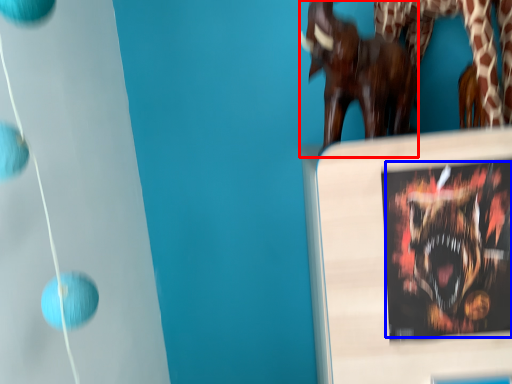
Question: Which object is closer to the camera taking this photo, sculpture (highlighted by a red box) or animal (highlighted by a blue box)?

Choices:
 (A) sculpture
 (B) animal

Answer: (B)